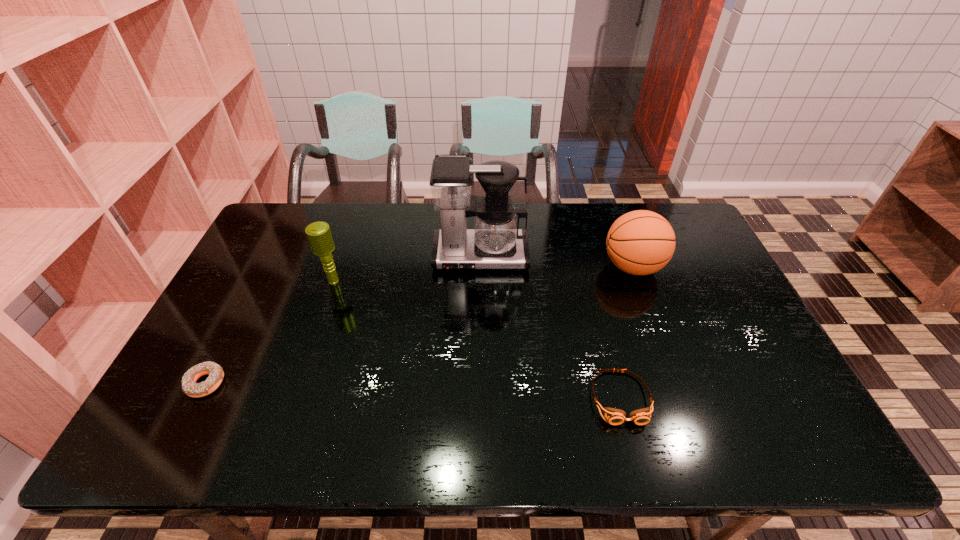
Locate an element on the screen. The image size is (960, 540). object that is the second closest to the leftmost object is located at coordinates (496, 242).

The image size is (960, 540). What are the coordinates of `vacant region that satisfies the following two spatial constraints: 1. on the back side of the leftmost object; 2. on the left side of the second object from left to right` in the screenshot? It's located at (258, 281).